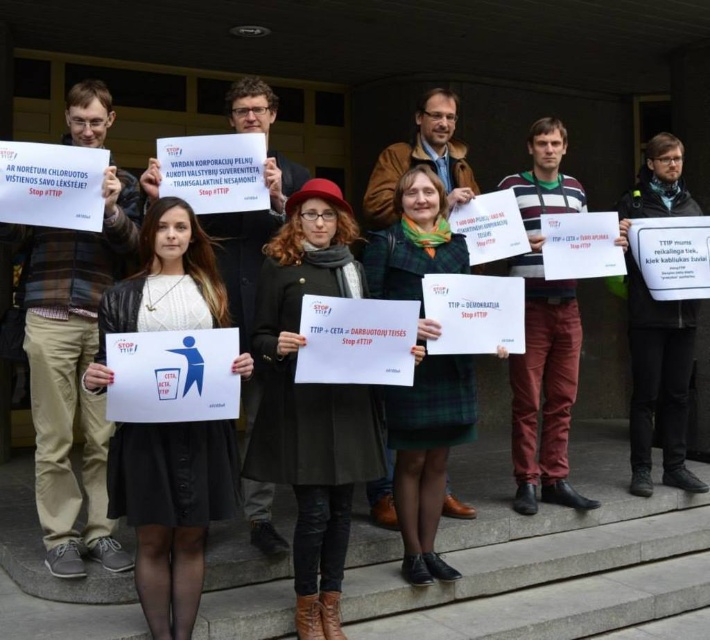
Does white matte sign at center appear under plaid shirt at left?

Yes, white matte sign at center is below plaid shirt at left.

Between white matte sign at center and plaid shirt at left, which one appears on the right side from the viewer's perspective?

white matte sign at center is more to the right.

Locate an element on the screen. white matte sign at center is located at coordinates (170, 509).

Does plaid shirt at left appear on the right side of dark brown leather jacket at center?

In fact, plaid shirt at left is to the left of dark brown leather jacket at center.

Between plaid shirt at left and dark brown leather jacket at center, which one has less height?

Standing shorter between the two is plaid shirt at left.

Which is in front, point (94, 524) or point (679, 449)?

Point (94, 524) is in front.

Find the location of a particular element. This screenshot has height=640, width=710. plaid shirt at left is located at coordinates [x=72, y=371].

Can you confirm if striped sweater at center is wider than dark brown leather jacket at center?

No.

Is point (540, 161) farther from viewer compared to point (677, 204)?

That is False.

Image resolution: width=710 pixels, height=640 pixels. I want to click on striped sweater at center, so click(x=545, y=332).

At what (x,y) coordinates should I click in order to perform the action: click on striped sweater at center. Please return your answer as a coordinate pair (x, y). Looking at the image, I should click on coord(545,332).